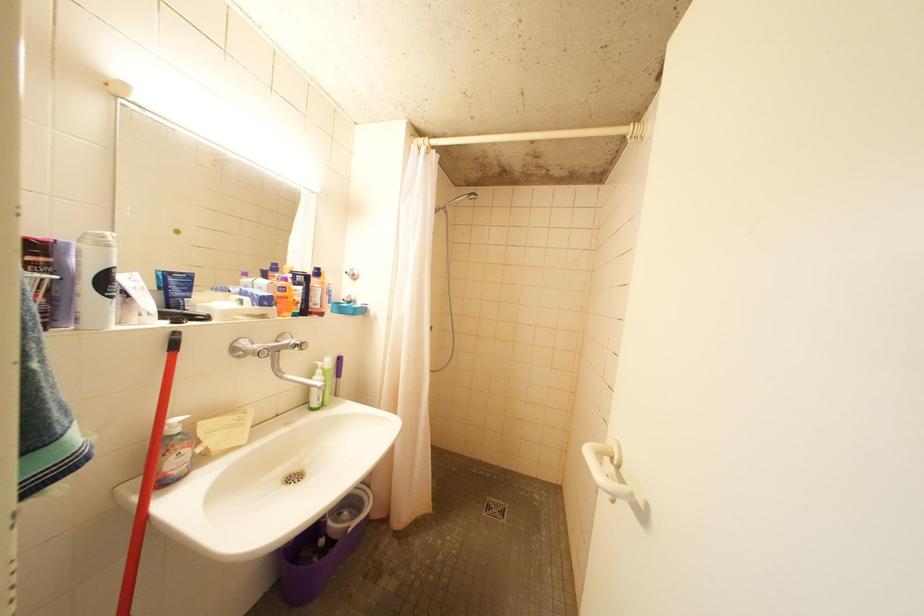
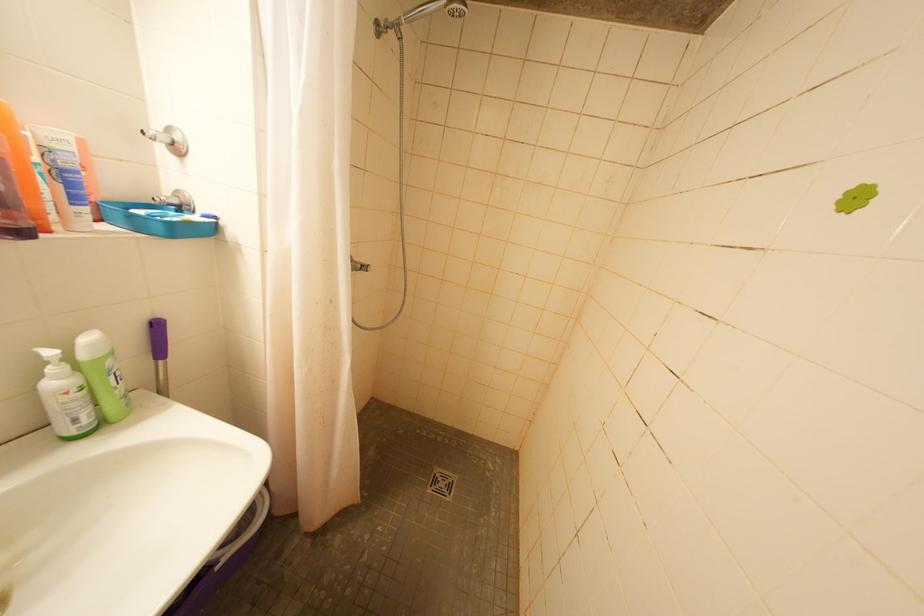
Question: The first image is from the beginning of the video and the second image is from the end. How did the camera likely rotate when shooting the video?

Choices:
 (A) Left
 (B) Right
 (C) Up
 (D) Down

Answer: (D)